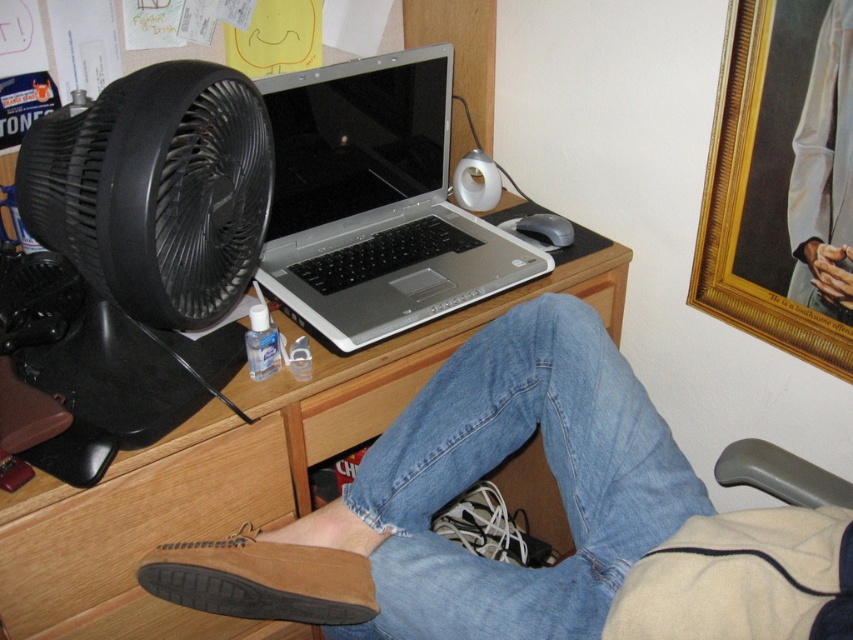
You are organizing a small event and need to place a rectangular tablecloth that is 1.2 meters wide. You have two options on the desk, the denim at center and the white satin robe at upper right. Which one is wider and suitable for covering the table?

The denim at center is wider than the white satin robe at upper right, so it is suitable for covering the 1.2 meter wide table.

Looking at this image, you are organizing items on your desk and want to place the gold textured picture frame at upper right next to the brown suede shoe at lower center. Considering their sizes, which one should you place first to ensure they fit properly?

The gold textured picture frame at upper right has a smaller width than the brown suede shoe at lower center. Therefore, you should place the brown suede shoe at lower center first, as it is larger, to ensure proper spacing for both items.

You are organizing items on the desk and need to place a new item between the wooden at center and the gold textured picture frame at upper right. Based on their current positions, which object should the new item be placed closer to?

The new item should be placed closer to the gold textured picture frame at upper right because the wooden at center is on the left side of it, meaning the gold textured picture frame at upper right is further to the right.